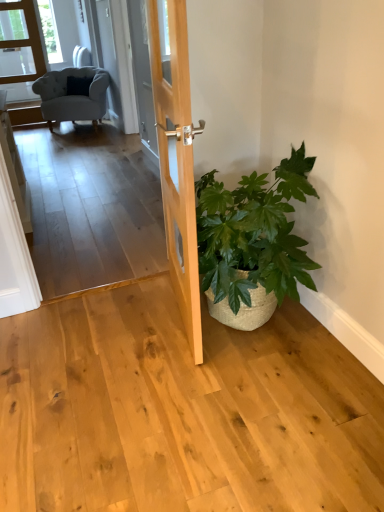
Question: Should I look upward or downward to see green woven basket at lower right?

Choices:
 (A) down
 (B) up

Answer: (B)

Question: From the image's perspective, is transparent glass door at upper left over green woven basket at lower right?

Choices:
 (A) no
 (B) yes

Answer: (B)

Question: Can you confirm if transparent glass door at upper left is taller than green woven basket at lower right?

Choices:
 (A) no
 (B) yes

Answer: (B)

Question: Is transparent glass door at upper left at the left side of green woven basket at lower right?

Choices:
 (A) yes
 (B) no

Answer: (A)

Question: Is transparent glass door at upper left oriented away from green woven basket at lower right?

Choices:
 (A) yes
 (B) no

Answer: (B)

Question: Could you tell me if transparent glass door at upper left is turned towards green woven basket at lower right?

Choices:
 (A) no
 (B) yes

Answer: (B)

Question: Can you confirm if transparent glass door at upper left is thinner than green woven basket at lower right?

Choices:
 (A) yes
 (B) no

Answer: (A)

Question: Would you say green woven basket at lower right is a long distance from transparent glass door at upper left?

Choices:
 (A) yes
 (B) no

Answer: (A)

Question: From a real-world perspective, is green woven basket at lower right beneath transparent glass door at upper left?

Choices:
 (A) no
 (B) yes

Answer: (B)

Question: From the image's perspective, is green woven basket at lower right above transparent glass door at upper left?

Choices:
 (A) yes
 (B) no

Answer: (B)

Question: Can you confirm if green woven basket at lower right is bigger than transparent glass door at upper left?

Choices:
 (A) no
 (B) yes

Answer: (B)

Question: Is green woven basket at lower right wider than transparent glass door at upper left?

Choices:
 (A) no
 (B) yes

Answer: (B)

Question: Could transparent glass door at upper left be considered to be inside green woven basket at lower right?

Choices:
 (A) yes
 (B) no

Answer: (B)

Question: Is light brown wood door at center aimed at green woven basket at lower right?

Choices:
 (A) yes
 (B) no

Answer: (A)